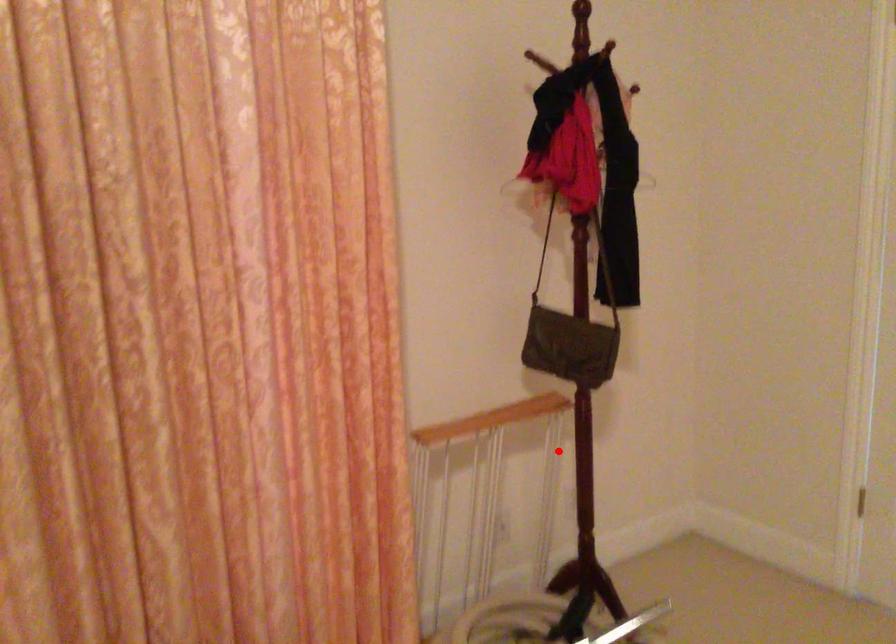
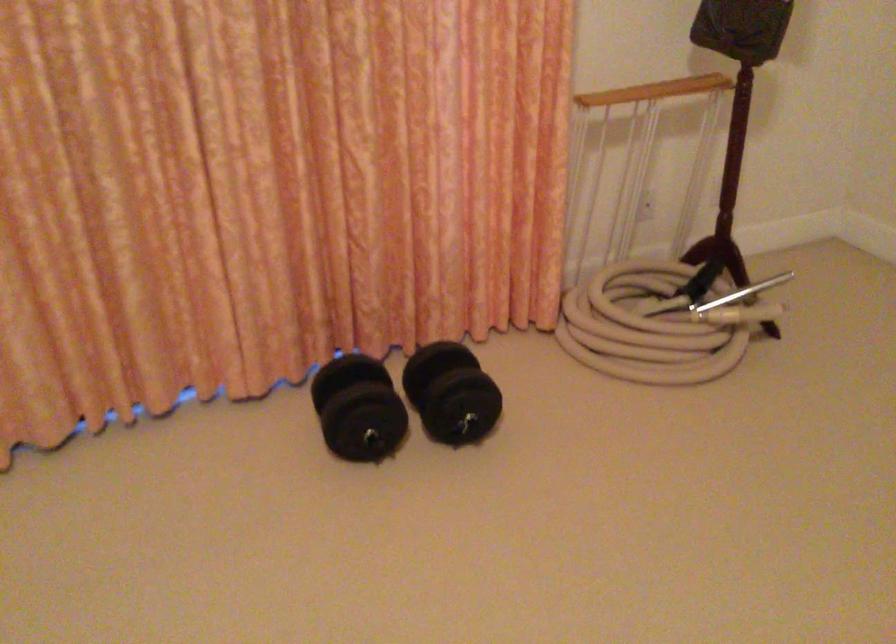
Question: I am providing you with two images of the same scene from different viewpoints. Given a red point in image1, look at the same physical point in image2. Is it:

Choices:
 (A) Closer to the viewpoint
 (B) Farther from the viewpoint

Answer: (B)